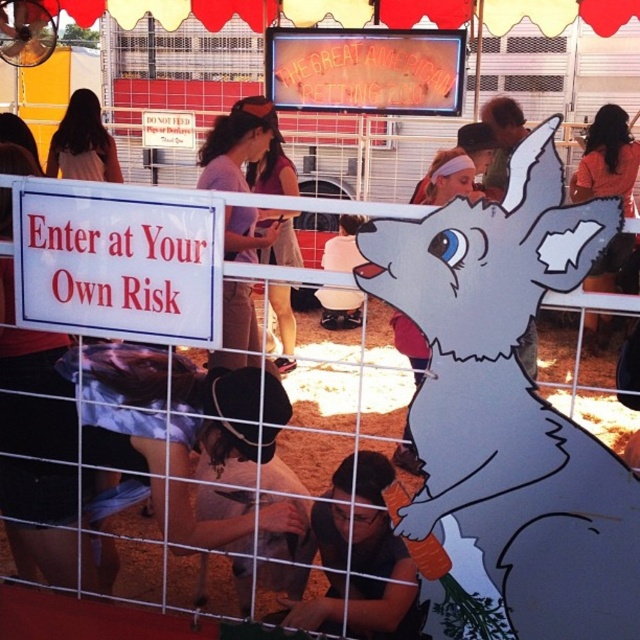
You are standing at the entrance of The Great American Petting Zoo and see two points marked in the image. Which point is closer to you, point [214,339] or point [326,250]?

Point [214,339] is closer to the viewer than point [326,250].

You are a visitor at The Great American Petting Zoo and see the white paper sign at center and the light purple fabric at center. According to the scene, which object is located to the left?

The white paper sign at center is positioned on the left side of light purple fabric at center, so the white paper sign at center is located to the left.